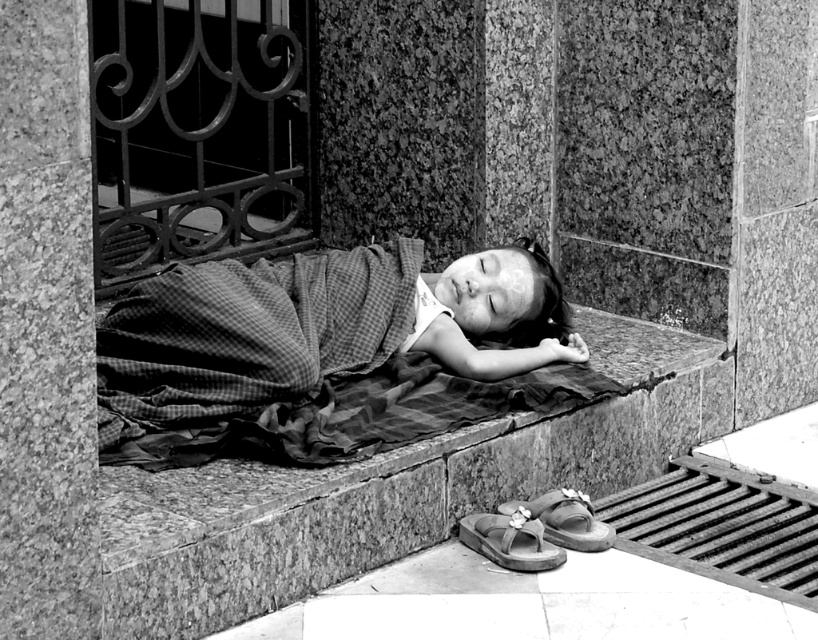
You are an architect analyzing the spatial layout of this urban setting. You need to determine which of the two points, point (439, 598) or point (554, 524), is situated closer to the observer. Can you identify the closer point based on the provided coordinates?

Point (439, 598) is closer to the viewer than point (554, 524).

You are a delivery robot with a 12 inch wide package. You need to place the package between the smooth concrete pavement at lower center and the leather sandal at lower center. Is there enough space?

The distance between the smooth concrete pavement at lower center and the leather sandal at lower center is 10.27 inches. Since the package is 12 inches wide, it will not fit in the space between them.